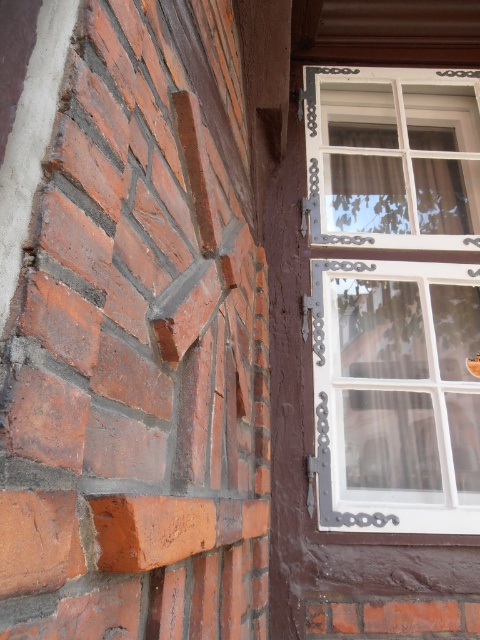
You are an architect examining the building exterior. You need to determine which object is taller between the white painted wood window at upper right and the smooth orange brick at lower left. Based on the scene, which one is taller?

The white painted wood window at upper right is taller than the smooth orange brick at lower left according to the description.

You are standing in front of the building and want to determine the relative positions of two points marked on the wall. Which point is closer to you, point (52, 252) or point (134, 516)?

Point (52, 252) is closer to the viewer than point (134, 516).